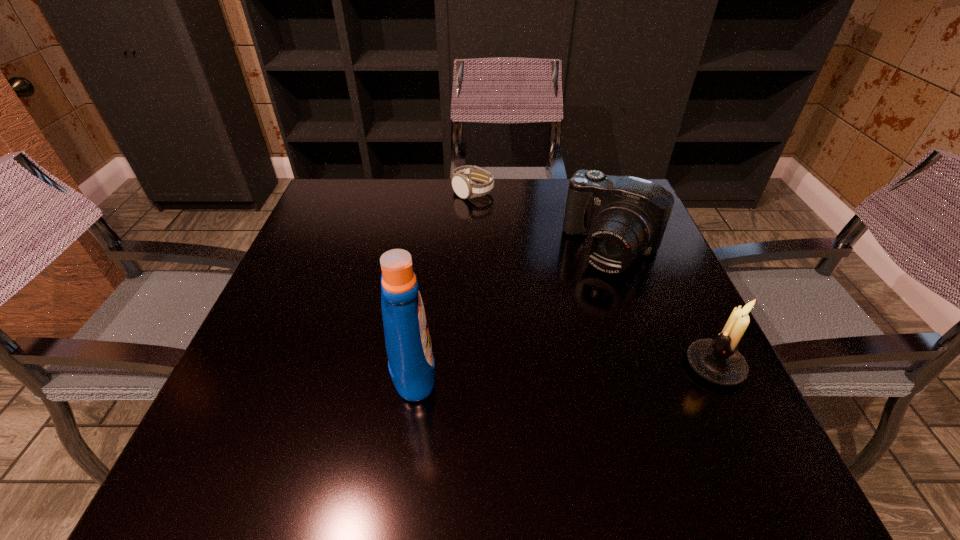
This screenshot has height=540, width=960. Identify the location of the leftmost object. (411, 364).

I want to click on the tallest object, so click(x=411, y=364).

Identify the location of candle holder. (718, 360).

In order to click on watch in this screenshot , I will do `click(463, 186)`.

You are a GUI agent. You are given a task and a screenshot of the screen. Output one action in this format:
    pyautogui.click(x=<x>, y=<y>)
    Task: Click on the second object from left to right
    This screenshot has height=540, width=960.
    Given the screenshot: What is the action you would take?
    pyautogui.click(x=463, y=186)

Where is `camera`? The image size is (960, 540). camera is located at coordinates (622, 216).

The width and height of the screenshot is (960, 540). I want to click on blank area located 0.330m on the label of the leftmost object, so click(x=613, y=367).

I want to click on vacant position located on the back of the candle holder, so click(x=684, y=303).

At what (x,y) coordinates should I click in order to perform the action: click on vacant space situated 0.380m on the face of the third object from right to left. Please return your answer as a coordinate pair (x, y). The image size is (960, 540). Looking at the image, I should click on (504, 297).

Find the location of `vacant space located on the face of the third object from right to left`. vacant space located on the face of the third object from right to left is located at coordinates (486, 234).